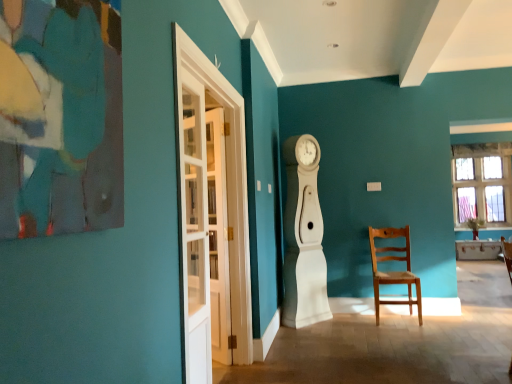
Question: Does white wooden door at left have a lesser width compared to white glass door at left, positioned as the 1th glass door in front-to-back order?

Choices:
 (A) yes
 (B) no

Answer: (A)

Question: Is white wooden door at left to the right of white glass door at left, the 2th glass door from the back, from the viewer's perspective?

Choices:
 (A) no
 (B) yes

Answer: (A)

Question: From the image's perspective, would you say white wooden door at left is positioned over white glass door at left, the 2th glass door from the back?

Choices:
 (A) no
 (B) yes

Answer: (A)

Question: Can you confirm if white wooden door at left is bigger than white glass door at left, positioned as the 1th glass door in front-to-back order?

Choices:
 (A) yes
 (B) no

Answer: (B)

Question: Can you confirm if white wooden door at left is wider than white glass door at left, the 2th glass door from the back?

Choices:
 (A) yes
 (B) no

Answer: (B)

Question: Considering the positions of white wooden door at left and light brown wooden chair at center right in the image, is white wooden door at left wider or thinner than light brown wooden chair at center right?

Choices:
 (A) thin
 (B) wide

Answer: (A)

Question: From the image's perspective, is white wooden door at left positioned above or below light brown wooden chair at center right?

Choices:
 (A) above
 (B) below

Answer: (A)

Question: From a real-world perspective, is white wooden door at left physically located above or below light brown wooden chair at center right?

Choices:
 (A) above
 (B) below

Answer: (A)

Question: Is white wooden door at left inside the boundaries of light brown wooden chair at center right, or outside?

Choices:
 (A) outside
 (B) inside

Answer: (A)

Question: Is clear glass window at upper right to the left or to the right of white glass door at left, the first glass door in the back-to-front sequence, in the image?

Choices:
 (A) right
 (B) left

Answer: (A)

Question: Is clear glass window at upper right situated inside white glass door at left, marked as the 2th glass door in a front-to-back arrangement, or outside?

Choices:
 (A) inside
 (B) outside

Answer: (B)

Question: Is clear glass window at upper right taller or shorter than white glass door at left, the first glass door in the back-to-front sequence?

Choices:
 (A) short
 (B) tall

Answer: (A)

Question: Relative to white glass door at left, the first glass door in the back-to-front sequence, is clear glass window at upper right in front or behind?

Choices:
 (A) behind
 (B) front

Answer: (A)

Question: Is point (483, 192) closer or farther from the camera than point (173, 33)?

Choices:
 (A) farther
 (B) closer

Answer: (A)

Question: In terms of width, does clear glass window at upper right look wider or thinner when compared to white glass door at left, positioned as the 1th glass door in front-to-back order?

Choices:
 (A) wide
 (B) thin

Answer: (A)